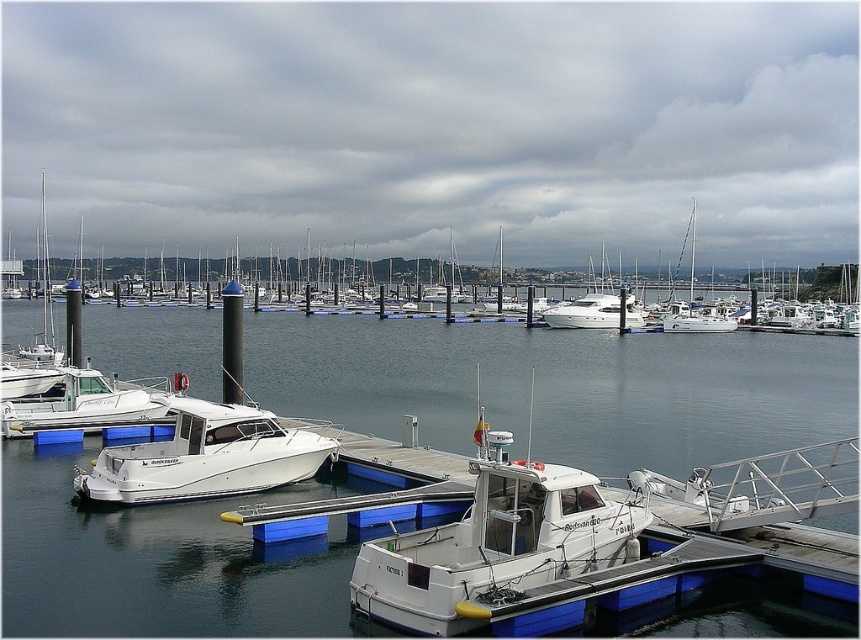
Who is positioned more to the left, white matte boat at center or white glossy sailboat at upper center?

From the viewer's perspective, white matte boat at center appears more on the left side.

Between point (414, 532) and point (708, 323), which one is positioned behind?

The point (708, 323) is more distant.

Where is `white matte boat at center`? The height and width of the screenshot is (640, 861). white matte boat at center is located at coordinates pyautogui.click(x=494, y=544).

From the picture: Can you confirm if white glossy boat at lower left is smaller than white glossy sailboat at upper center?

Yes.

This screenshot has height=640, width=861. What do you see at coordinates (84, 404) in the screenshot?
I see `white glossy boat at lower left` at bounding box center [84, 404].

At what (x,y) coordinates should I click in order to perform the action: click on white glossy boat at lower left. Please return your answer as a coordinate pair (x, y). The width and height of the screenshot is (861, 640). Looking at the image, I should click on (84, 404).

Is white glossy yacht at center smaller than white glossy sailboat at upper center?

Correct, white glossy yacht at center occupies less space than white glossy sailboat at upper center.

Is white glossy yacht at center closer to the viewer compared to white glossy sailboat at upper center?

Yes.

Where is `white glossy yacht at center`? The height and width of the screenshot is (640, 861). white glossy yacht at center is located at coordinates (596, 307).